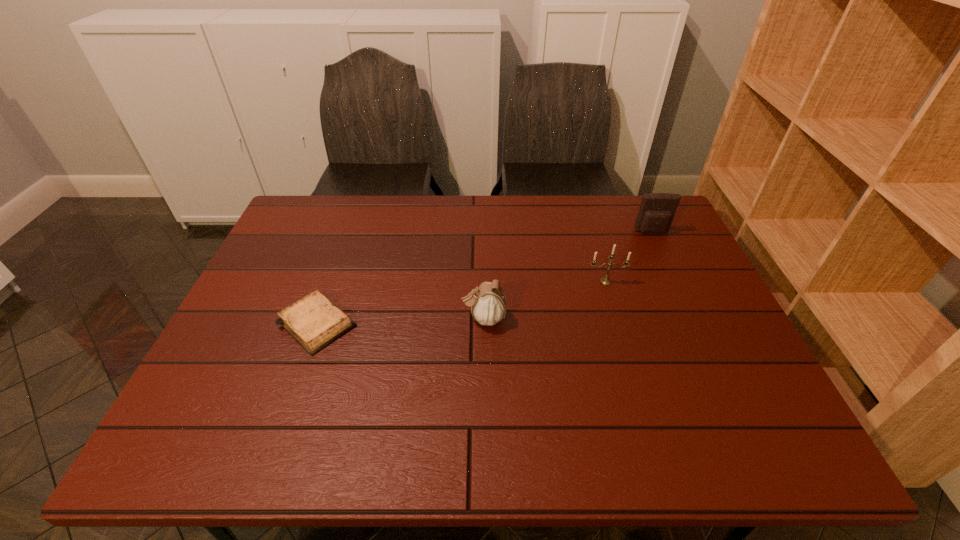
Where is `vacant space located 0.060m on the front-facing side of the second object from left to right`? The width and height of the screenshot is (960, 540). vacant space located 0.060m on the front-facing side of the second object from left to right is located at coordinates (438, 319).

Identify the location of vacant region located on the front-facing side of the second object from left to right. pyautogui.click(x=415, y=319).

Where is `vacant area situated 0.400m on the front-facing side of the second object from left to right`? The width and height of the screenshot is (960, 540). vacant area situated 0.400m on the front-facing side of the second object from left to right is located at coordinates (306, 319).

Where is `vacant region located 0.150m on the right of the shortest object`? The width and height of the screenshot is (960, 540). vacant region located 0.150m on the right of the shortest object is located at coordinates (417, 323).

Locate an element on the screen. object at the far edge is located at coordinates (657, 210).

You are a GUI agent. You are given a task and a screenshot of the screen. Output one action in this format:
    pyautogui.click(x=<x>, y=<y>)
    Task: Click on the object at the left edge
    
    Given the screenshot: What is the action you would take?
    pyautogui.click(x=314, y=321)

I want to click on object that is at the right edge, so click(x=657, y=210).

The height and width of the screenshot is (540, 960). I want to click on object at the far right corner, so click(657, 210).

In the image, there is a desktop. Identify the location of vacant space at the far edge. (414, 214).

Identify the location of vacant space at the left edge of the desktop. The width and height of the screenshot is (960, 540). (292, 255).